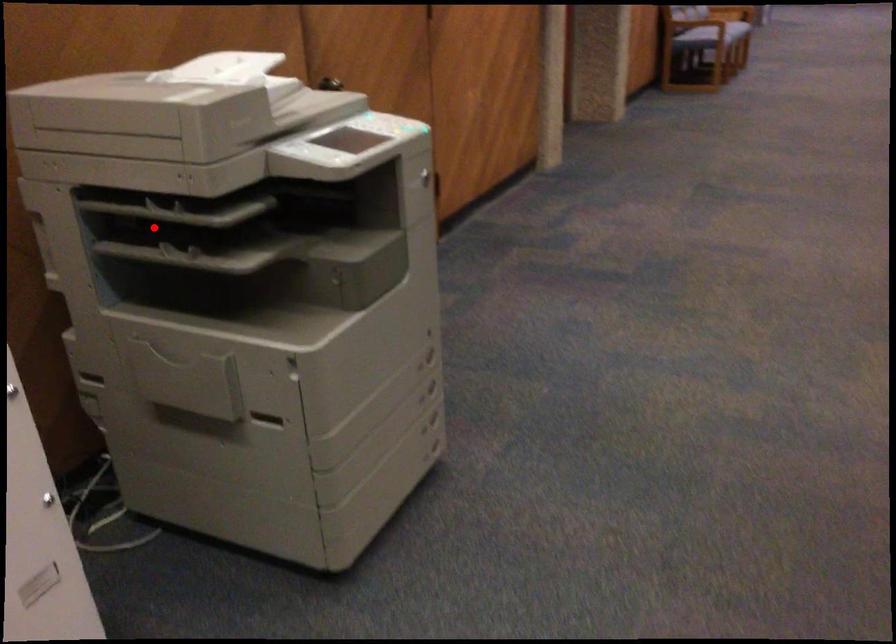
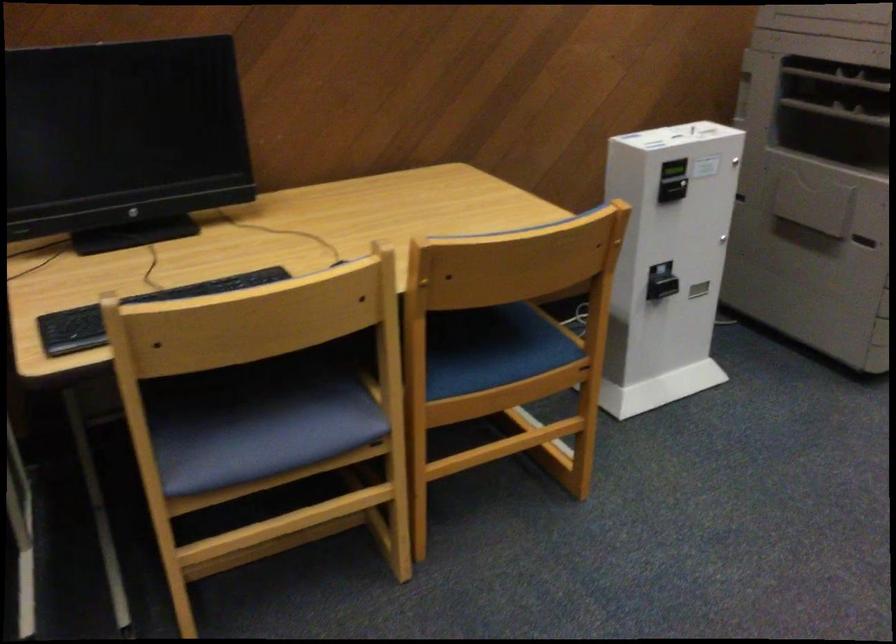
In the second image, find the point that corresponds to the highlighted location in the first image.

(839, 79)